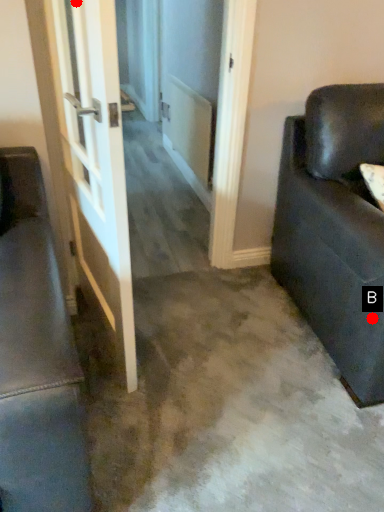
Question: Two points are circled on the image, labeled by A and B beside each circle. Which point is further to the camera?

Choices:
 (A) A is further
 (B) B is further

Answer: (B)